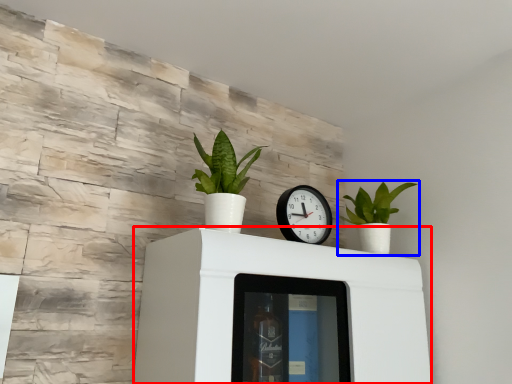
Question: Which object appears farthest to the camera in this image, furniture (highlighted by a red box) or houseplant (highlighted by a blue box)?

Choices:
 (A) furniture
 (B) houseplant

Answer: (B)